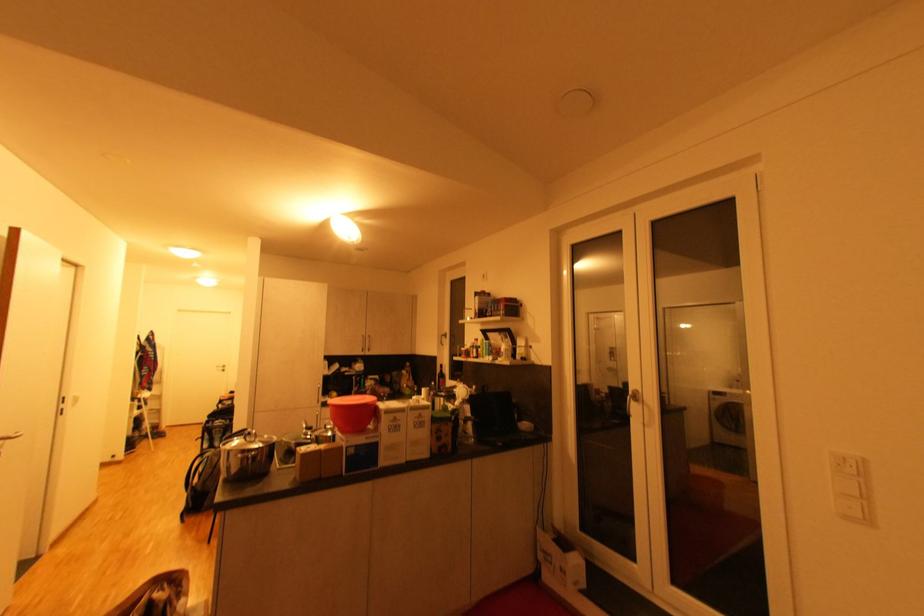
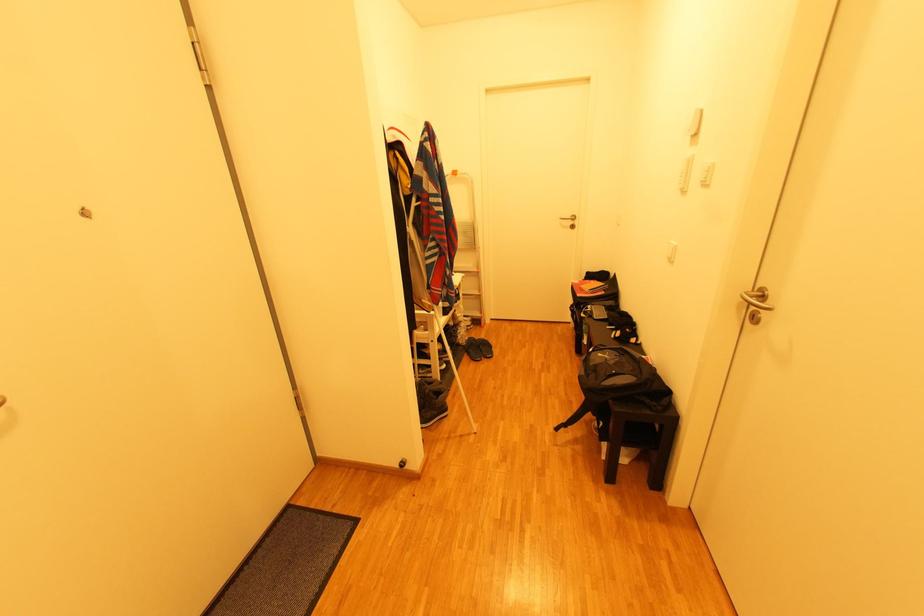
Where in the second image is the point corresponding to [161,421] from the first image?

(481, 315)